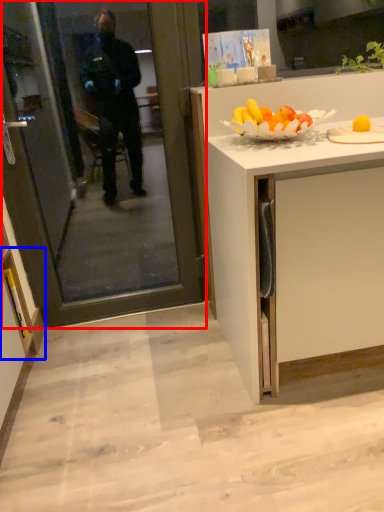
Question: Among these objects, which one is farthest to the camera, screen door (highlighted by a red box) or cabinetry (highlighted by a blue box)?

Choices:
 (A) screen door
 (B) cabinetry

Answer: (B)